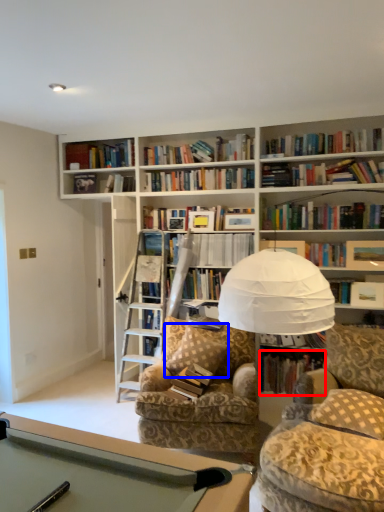
Question: Which object is closer to the camera taking this photo, book (highlighted by a red box) or pillow (highlighted by a blue box)?

Choices:
 (A) book
 (B) pillow

Answer: (B)